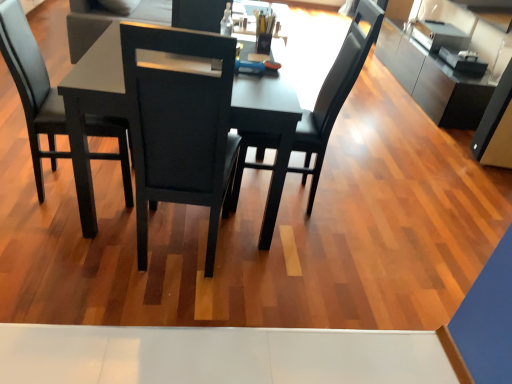
Question: Is satin silver cabinet at upper right bigger or smaller than black leather chair at left, the first chair from the left?

Choices:
 (A) big
 (B) small

Answer: (A)

Question: In terms of height, does satin silver cabinet at upper right look taller or shorter compared to black leather chair at left, the first chair from the left?

Choices:
 (A) short
 (B) tall

Answer: (A)

Question: Which object is positioned farthest from the black matte chair at center, the 1th chair when ordered from right to left?

Choices:
 (A) satin silver cabinet at upper right
 (B) matte black table at center
 (C) black leather chair at left, the first chair from the left

Answer: (A)

Question: Considering the real-world distances, which object is farthest from the black leather chair at left, the first chair from the left?

Choices:
 (A) satin silver cabinet at upper right
 (B) black matte chair at center, the 1th chair when ordered from right to left
 (C) matte black table at center

Answer: (A)